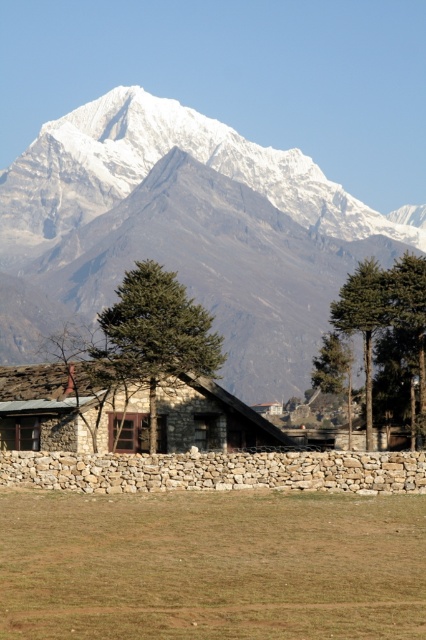
You are standing in front of the stone textured hut at center and want to step onto the brown grass at lower center. Which direction should you move to reach it?

The brown grass at lower center is positioned on the right side of the stone textured hut at center, so you should move to your right to reach it.

You are planning to build a new cabin near the stone textured hut at center. Considering the snowy granite mountain range at upper center, which structure is taller and should be considered for visibility when choosing the cabin location?

The snowy granite mountain range at upper center is taller than the stone textured hut at center, so when building the cabin, you should consider the height of the mountain range to ensure visibility.

You are standing in the landscape and want to place a small garden statue that requires a flat surface. Given the brown grass at lower center and the stone textured hut at center, which location would provide a more level area for the statue?

The brown grass at lower center has a lesser height compared to the stone textured hut at center, so the grass area would be flatter and more suitable for placing the statue.